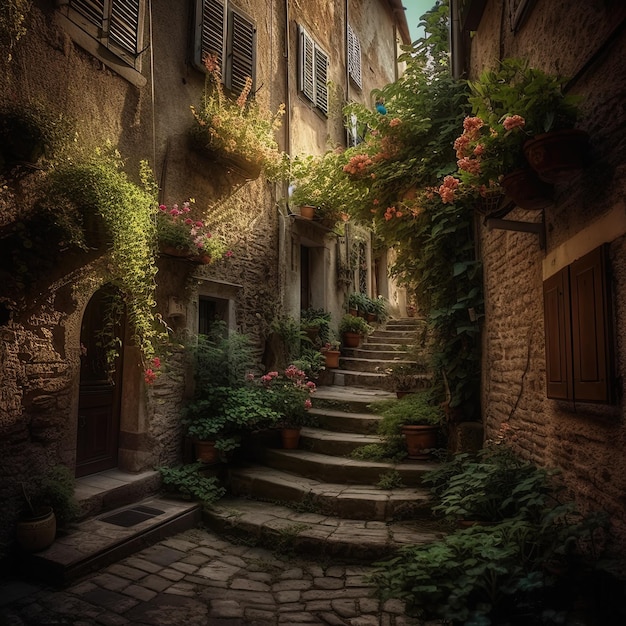
Identify the location of window sill. This screenshot has height=626, width=626. 121,69.